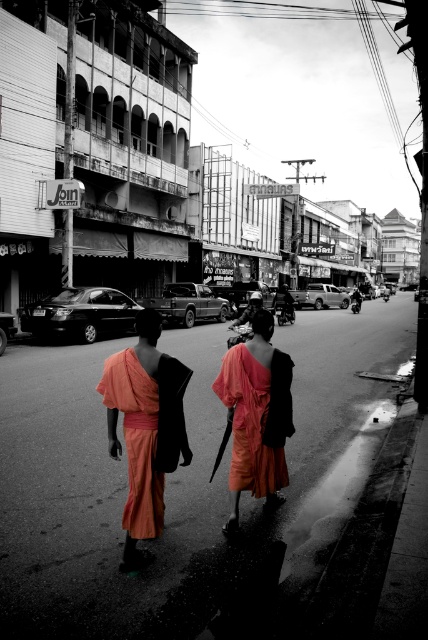
Between orange cotton robe at center and matte orange robe at center, which one is positioned lower?

matte orange robe at center is lower down.

Between orange cotton robe at center and matte orange robe at center, which one appears on the right side from the viewer's perspective?

matte orange robe at center

Measure the distance between point (122, 516) and camera.

Point (122, 516) is 4.58 meters from camera.

At what (x,y) coordinates should I click in order to perform the action: click on orange cotton robe at center. Please return your answer as a coordinate pair (x, y). This screenshot has width=428, height=640. Looking at the image, I should click on tap(145, 429).